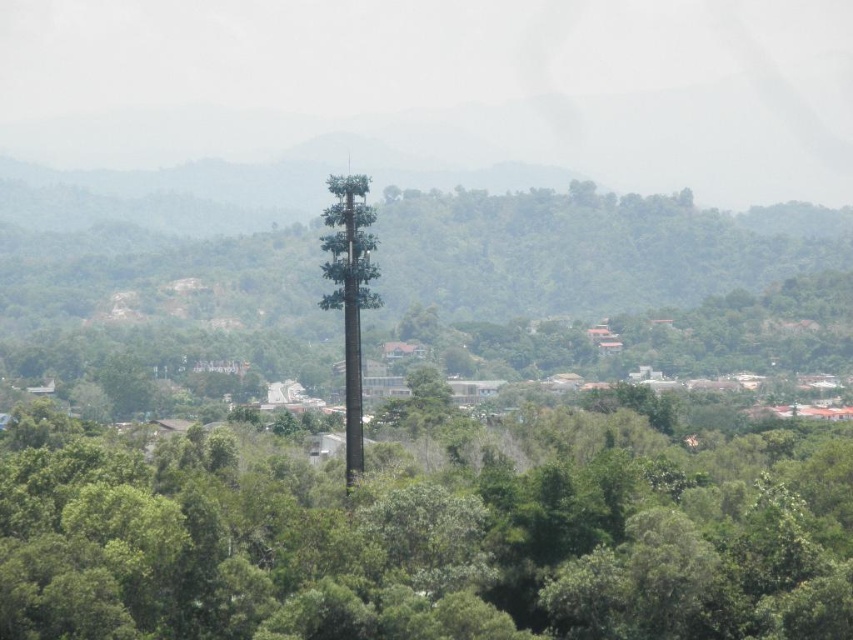
Question: Which point appears closest to the camera in this image?

Choices:
 (A) (x=334, y=250)
 (B) (x=734, y=636)

Answer: (B)

Question: Observing the image, what is the correct spatial positioning of green matte pole at center in reference to green matte tower at center?

Choices:
 (A) below
 (B) above

Answer: (A)

Question: Is green matte pole at center to the left of green matte tower at center from the viewer's perspective?

Choices:
 (A) yes
 (B) no

Answer: (B)

Question: Is green matte pole at center bigger than green matte tower at center?

Choices:
 (A) yes
 (B) no

Answer: (A)